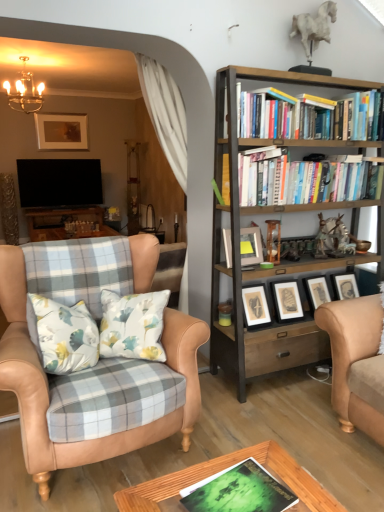
The image size is (384, 512). What are the coordinates of `vacant point to the right of tan leather chair at left` in the screenshot? It's located at (280, 425).